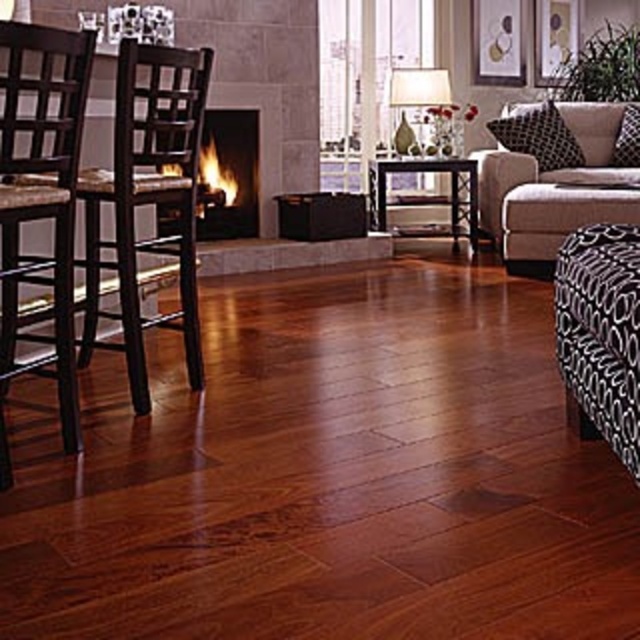
Question: Which object is the closest to the matte dark wood chair at left?

Choices:
 (A) beige fabric couch at right
 (B) matte black fireplace at center

Answer: (B)

Question: Is beige fabric couch at right wider than matte black fireplace at center?

Choices:
 (A) no
 (B) yes

Answer: (B)

Question: Among these objects, which one is nearest to the camera?

Choices:
 (A) black printed cushion at upper right
 (B) beige fabric couch at right
 (C) matte brown wood chair at left
 (D) matte dark wood chair at left

Answer: (C)

Question: Is the position of beige fabric couch at right less distant than that of black printed cushion at upper right?

Choices:
 (A) no
 (B) yes

Answer: (B)

Question: Does matte dark wood chair at left have a smaller size compared to dark brown wood table at center?

Choices:
 (A) yes
 (B) no

Answer: (B)

Question: Considering the real-world distances, which object is closest to the white fabric lampshade at upper center?

Choices:
 (A) matte dark wood chair at left
 (B) black dotted pillow at upper right
 (C) matte brown wood chair at left

Answer: (B)